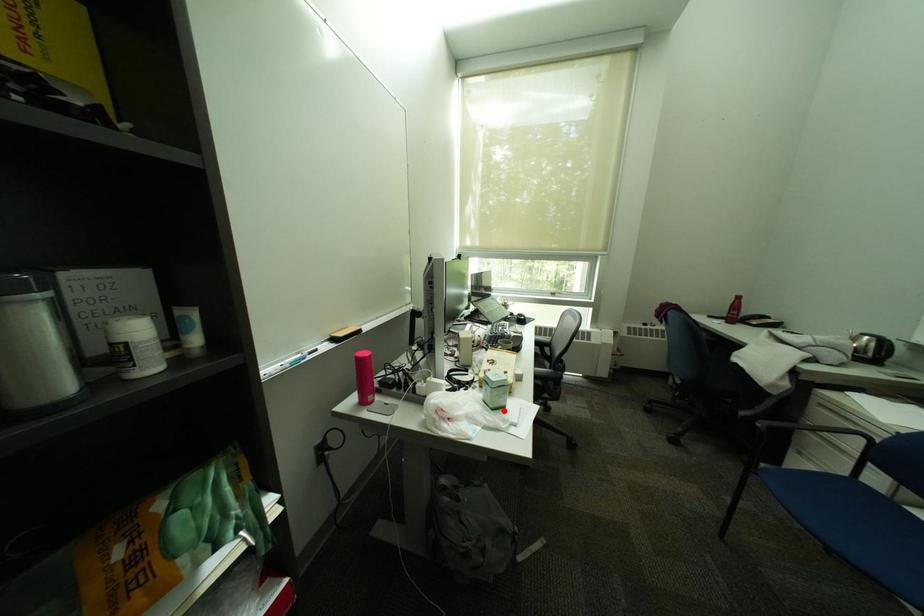
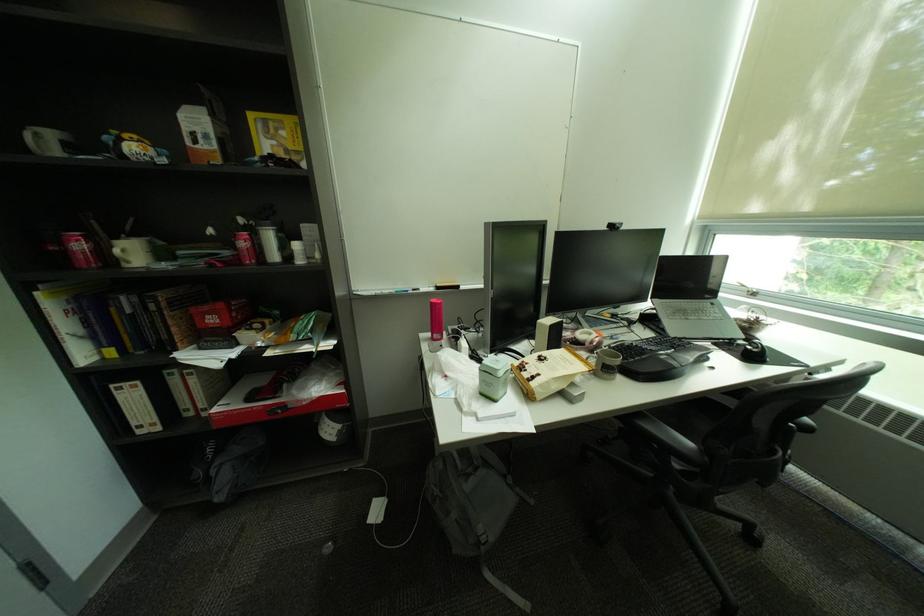
Question: I am providing you with two images of the same scene from different viewpoints. A red point is marked on the first image. Is the red point's position out of view in image 2?

Choices:
 (A) Yes
 (B) No

Answer: (B)